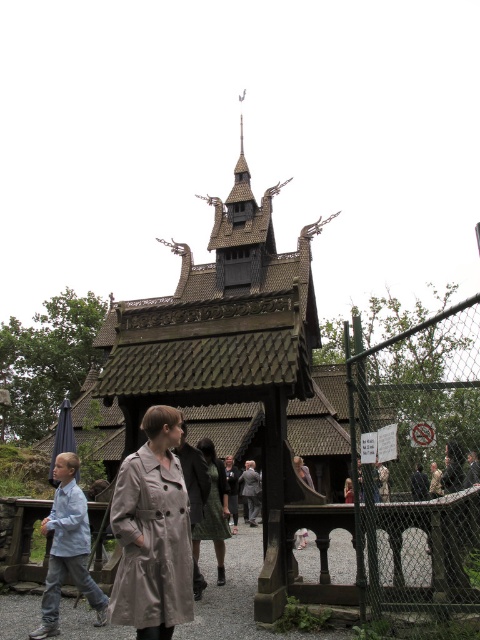
Is light blue denim jeans at lower left shorter than matte black dress at center?

Indeed, light blue denim jeans at lower left has a lesser height compared to matte black dress at center.

The height and width of the screenshot is (640, 480). Find the location of `light blue denim jeans at lower left`. light blue denim jeans at lower left is located at coordinates (68, 548).

Where is `light blue denim jeans at lower left`? This screenshot has width=480, height=640. light blue denim jeans at lower left is located at coordinates (68, 548).

Between point (395, 502) and point (214, 509), which one is positioned behind?

Positioned behind is point (214, 509).

Is point (377, 618) positioned behind point (224, 470)?

No, (377, 618) is closer to viewer.

Where is `green chain-link fence at right`? The width and height of the screenshot is (480, 640). green chain-link fence at right is located at coordinates (419, 460).

Is light blue denim jeans at lower left closer to the viewer compared to matte brown coat at center?

Yes, light blue denim jeans at lower left is in front of matte brown coat at center.

Which of these two, light blue denim jeans at lower left or matte brown coat at center, stands taller?

light blue denim jeans at lower left

Where is `light blue denim jeans at lower left`? The image size is (480, 640). light blue denim jeans at lower left is located at coordinates (68, 548).